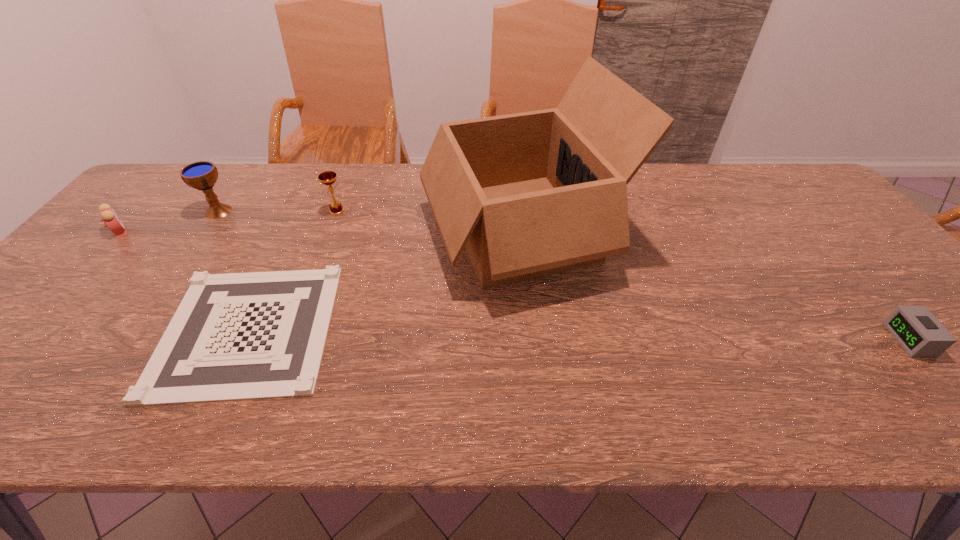
This screenshot has height=540, width=960. Identify the location of checkerboard. (236, 336).

Locate an element on the screen. free location located on the right of the fifth object from left to right is located at coordinates (730, 230).

This screenshot has height=540, width=960. Find the location of `free point located on the right of the second object from left to right`. free point located on the right of the second object from left to right is located at coordinates [324, 211].

Locate an element on the screen. This screenshot has width=960, height=540. vacant space located 0.190m on the right of the fourth shortest object is located at coordinates (410, 211).

At what (x,y) coordinates should I click in order to perform the action: click on free space located 0.330m on the face of the leftmost object. Please return your answer as a coordinate pair (x, y). This screenshot has width=960, height=540. Looking at the image, I should click on (249, 232).

At what (x,y) coordinates should I click in order to perform the action: click on blank space located on the front-facing side of the rightmost object. Please return your answer as a coordinate pair (x, y). The width and height of the screenshot is (960, 540). Looking at the image, I should click on (729, 340).

At what (x,y) coordinates should I click in order to perform the action: click on vacant space positioned 0.070m on the front-facing side of the rightmost object. Please return your answer as a coordinate pair (x, y). Image resolution: width=960 pixels, height=540 pixels. Looking at the image, I should click on tap(864, 340).

In order to click on free point located 0.370m on the front-facing side of the rightmost object in this screenshot , I will do pos(729,340).

This screenshot has height=540, width=960. Identify the location of vacant region located on the left of the shortest object. (27, 329).

Where is `box at the far edge`? The image size is (960, 540). box at the far edge is located at coordinates (532, 194).